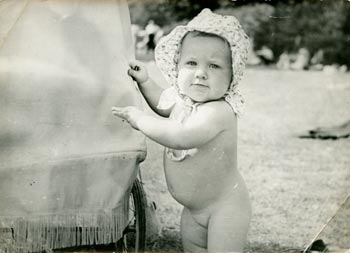
I want to click on floor, so coord(318,192).